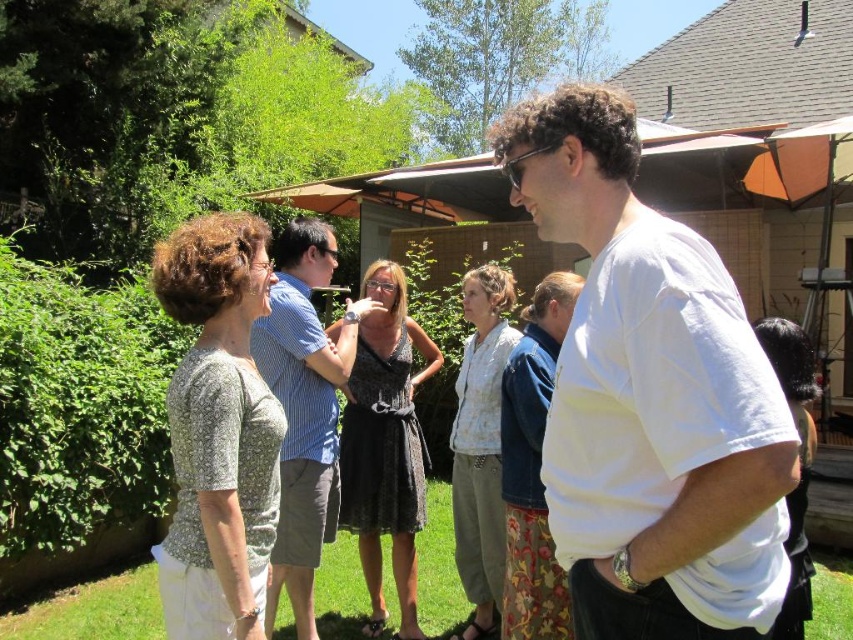
Question: In this image, where is light gray fabric dress at center located relative to matte black dress at center?

Choices:
 (A) below
 (B) above

Answer: (A)

Question: Considering the relative positions of blue striped shirt at center and black lace dress at center in the image provided, where is blue striped shirt at center located with respect to black lace dress at center?

Choices:
 (A) right
 (B) left

Answer: (B)

Question: Which object is the closest to the light gray textured blouse at center?

Choices:
 (A) light gray fabric dress at center
 (B) black lace dress at center
 (C) matte black dress at center

Answer: (C)

Question: Is floral skirt at center above light gray fabric dress at center?

Choices:
 (A) no
 (B) yes

Answer: (B)

Question: Which of the following is the closest to the observer?

Choices:
 (A) (274, 291)
 (B) (345, 497)

Answer: (A)

Question: Among these objects, which one is farthest from the camera?

Choices:
 (A) matte black dress at center
 (B) blue striped shirt at center

Answer: (B)